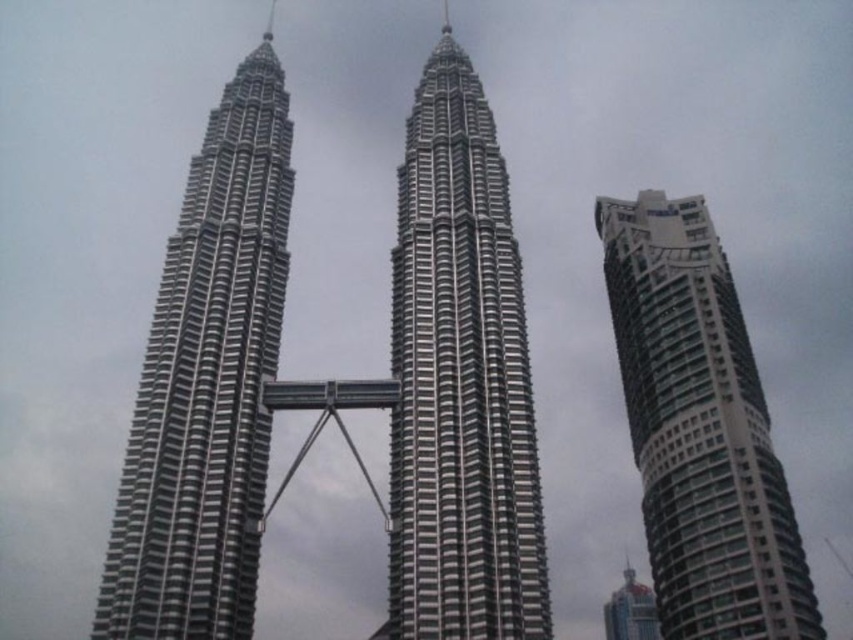
Question: From the image, what is the correct spatial relationship of silver metallic building at center in relation to silver metallic twin towers at center?

Choices:
 (A) left
 (B) right

Answer: (B)

Question: Which point is closer to the camera?

Choices:
 (A) (683, 627)
 (B) (225, 120)
 (C) (421, 621)

Answer: (C)

Question: Which of the following is the closest to the observer?

Choices:
 (A) (648, 593)
 (B) (418, 380)
 (C) (138, 563)
 (D) (654, 244)

Answer: (C)

Question: Does silver metallic twin towers at center lie in front of shiny blue glass skyscraper at lower right?

Choices:
 (A) yes
 (B) no

Answer: (A)

Question: Is silver metallic building at center to the left of shiny blue glass skyscraper at lower right from the viewer's perspective?

Choices:
 (A) yes
 (B) no

Answer: (A)

Question: Which of these objects is positioned closest to the silver metallic building at center?

Choices:
 (A) white glass building at right
 (B) shiny blue glass skyscraper at lower right
 (C) silver metallic twin towers at center

Answer: (C)